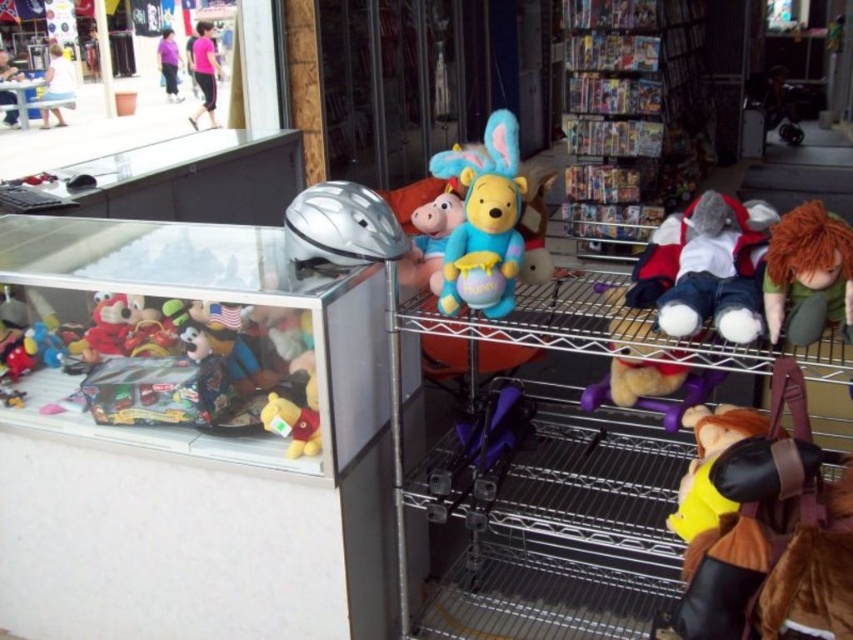
Is green felt doll at right to the left of matte red plush toy at left from the viewer's perspective?

In fact, green felt doll at right is to the right of matte red plush toy at left.

Is point (827, 244) farther from camera compared to point (109, 332)?

No.

Between point (805, 292) and point (117, 298), which one is positioned behind?

The point (117, 298) is more distant.

You are a GUI agent. You are given a task and a screenshot of the screen. Output one action in this format:
    pyautogui.click(x=<x>, y=<y>)
    Task: Click on the green felt doll at right
    The height and width of the screenshot is (640, 853).
    Given the screenshot: What is the action you would take?
    pyautogui.click(x=807, y=272)

Between white plush toy at center-right and yellow plush toy at lower left, which one is positioned higher?

white plush toy at center-right

Is white plush toy at center-right to the left of yellow plush toy at lower left from the viewer's perspective?

No, white plush toy at center-right is not to the left of yellow plush toy at lower left.

Who is more forward, (704, 198) or (291, 436)?

Positioned in front is point (704, 198).

I want to click on white plush toy at center-right, so click(x=717, y=269).

Can you confirm if white plush toy at center-right is positioned to the right of matte blue plush at center?

Yes, white plush toy at center-right is to the right of matte blue plush at center.

Can you confirm if white plush toy at center-right is bigger than matte blue plush at center?

Correct, white plush toy at center-right is larger in size than matte blue plush at center.

You are a GUI agent. You are given a task and a screenshot of the screen. Output one action in this format:
    pyautogui.click(x=<x>, y=<y>)
    Task: Click on the white plush toy at center-right
    The height and width of the screenshot is (640, 853).
    Given the screenshot: What is the action you would take?
    pyautogui.click(x=717, y=269)